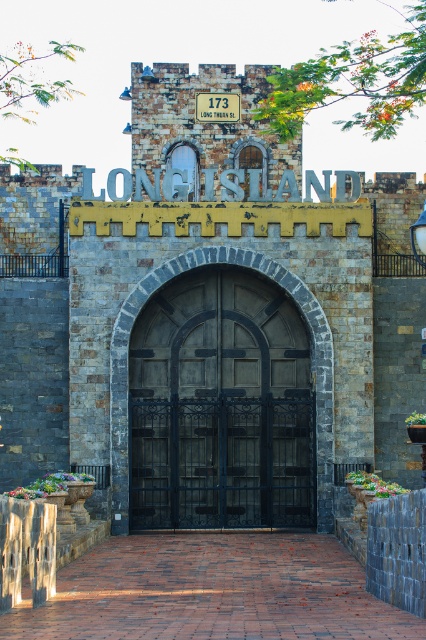
Question: Which object appears closest to the camera in this image?

Choices:
 (A) dark wood gate at center
 (B) white brick sign at center

Answer: (A)

Question: Which point is closer to the camera?

Choices:
 (A) (245, 275)
 (B) (198, 97)

Answer: (A)

Question: Considering the relative positions of dark wood gate at center and white brick sign at center in the image provided, where is dark wood gate at center located with respect to white brick sign at center?

Choices:
 (A) right
 (B) left

Answer: (A)

Question: Is dark wood gate at center wider than white brick sign at center?

Choices:
 (A) yes
 (B) no

Answer: (A)

Question: Considering the relative positions of dark wood gate at center and white brick sign at center in the image provided, where is dark wood gate at center located with respect to white brick sign at center?

Choices:
 (A) below
 (B) above

Answer: (A)

Question: Which object is closer to the camera taking this photo?

Choices:
 (A) dark wood gate at center
 (B) white brick sign at center

Answer: (A)